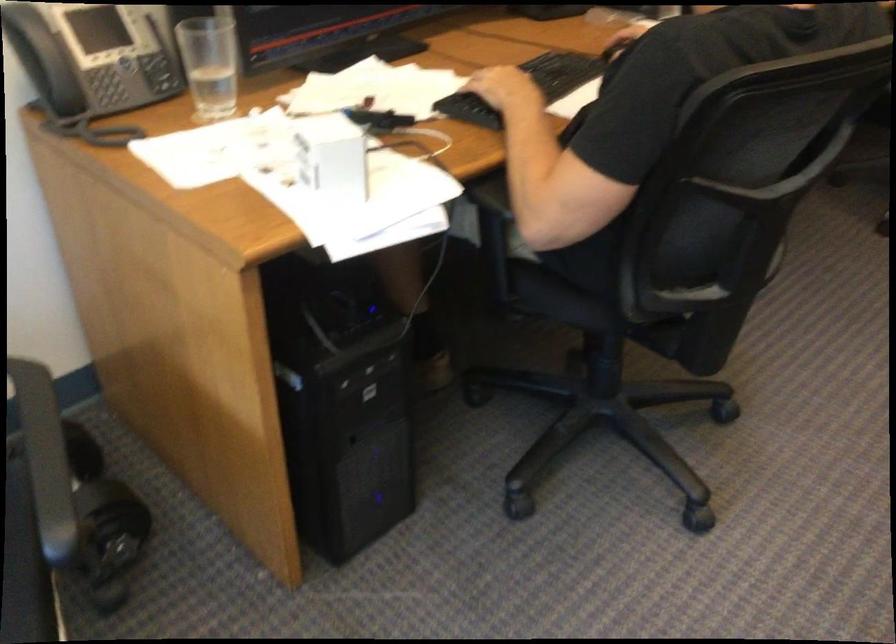
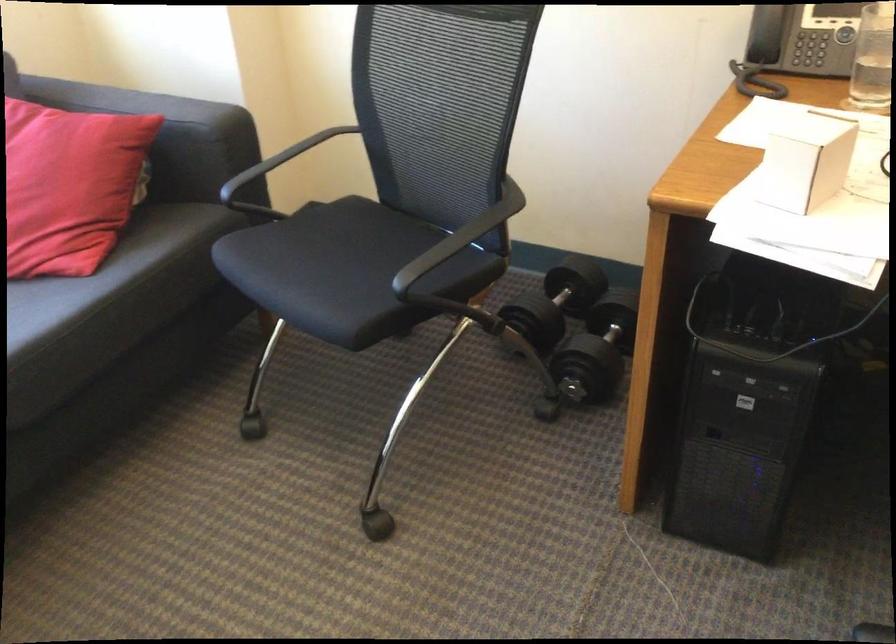
Where in the second image is the point corresponding to [346,155] from the first image?

(805, 162)